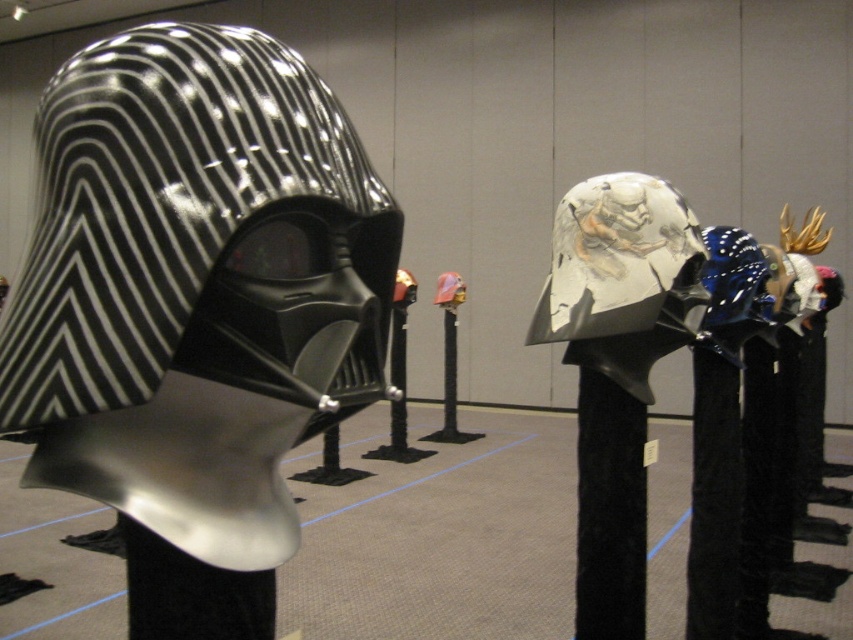
You are an interior designer planning to place a decorative item between the black glossy helmet at left and the black velvet pillar at center. Which object should the item be placed closer to if you want it to fit within the narrower space?

The item should be placed closer to the black velvet pillar at center because it has a narrower width compared to the black glossy helmet at left.

In the scene shown: You are an interior designer planning to place a 18 inch wide decorative item between the black velvet pillar at center and the black velvet post at center. Is there enough space for it?

The distance between the black velvet pillar at center and the black velvet post at center is 21.93 inches. Since the decorative item is 18 inches wide, there is enough space to place it between them.